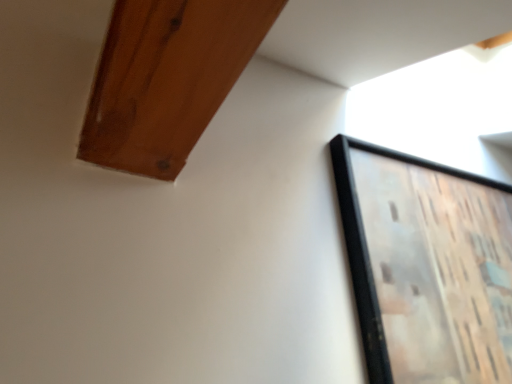
What is the approximate width of black matte picture frame at upper right?

black matte picture frame at upper right is 5.11 inches in width.

Locate an element on the screen. black matte picture frame at upper right is located at coordinates (426, 266).

What do you see at coordinates (426, 266) in the screenshot? The image size is (512, 384). I see `black matte picture frame at upper right` at bounding box center [426, 266].

The image size is (512, 384). What are the coordinates of `black matte picture frame at upper right` in the screenshot? It's located at (426, 266).